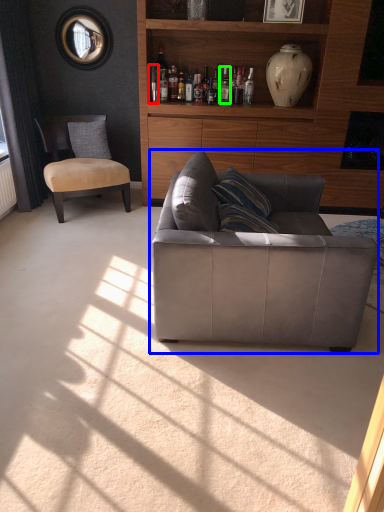
Question: Considering the real-world distances, which object is farthest from bottle (highlighted by a red box)? studio couch (highlighted by a blue box) or bottle (highlighted by a green box)?

Choices:
 (A) studio couch
 (B) bottle

Answer: (A)